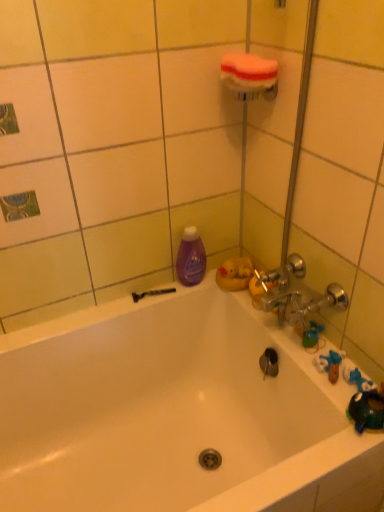
Locate an element on the screen. This screenshot has width=384, height=512. free space to the back side of green rubber toy at right is located at coordinates (276, 313).